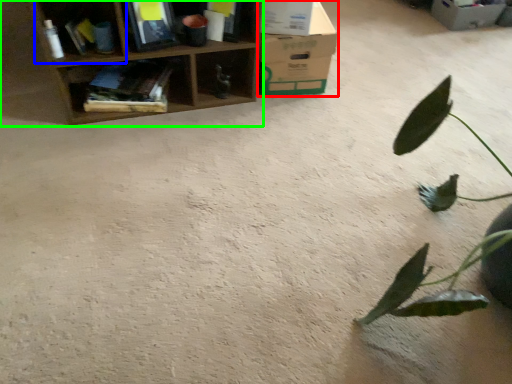
Question: Based on their relative distances, which object is farther from cardboard box (highlighted by a red box)? Choose from shelf (highlighted by a blue box) and shelf (highlighted by a green box).

Choices:
 (A) shelf
 (B) shelf

Answer: (A)